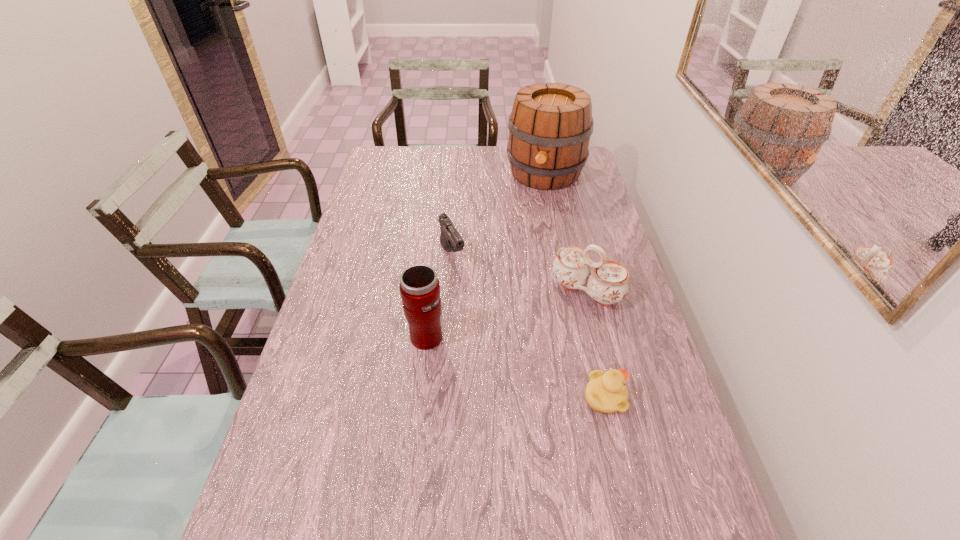
Where is `free region located 0.140m on the side with the handle of the second tallest object`? Image resolution: width=960 pixels, height=540 pixels. free region located 0.140m on the side with the handle of the second tallest object is located at coordinates (351, 336).

The height and width of the screenshot is (540, 960). What are the coordinates of `vacant space located on the beak of the nearest object` in the screenshot? It's located at (669, 397).

Locate an element on the screen. blank space located 0.350m at the barrel of the pistol is located at coordinates (506, 357).

At what (x,y) coordinates should I click in order to perform the action: click on free spot located 0.350m at the barrel of the pistol. Please return your answer as a coordinate pair (x, y). The height and width of the screenshot is (540, 960). Looking at the image, I should click on (506, 357).

At what (x,y) coordinates should I click in order to perform the action: click on vacant space located 0.140m at the barrel of the pistol. Please return your answer as a coordinate pair (x, y). The width and height of the screenshot is (960, 540). Looking at the image, I should click on (474, 301).

Locate an element on the screen. This screenshot has width=960, height=540. free space located by the handle of the third tallest object is located at coordinates (516, 386).

Identify the location of vacant region located by the handle of the third tallest object. The height and width of the screenshot is (540, 960). pos(554,333).

The image size is (960, 540). Find the location of `vacant space located 0.230m by the handle of the third tallest object`. vacant space located 0.230m by the handle of the third tallest object is located at coordinates (530, 366).

This screenshot has width=960, height=540. I want to click on vacant point located on the side of the farthest object where the spigot is located, so click(523, 248).

I want to click on vacant space situated 0.290m on the side of the farthest object where the spigot is located, so click(524, 244).